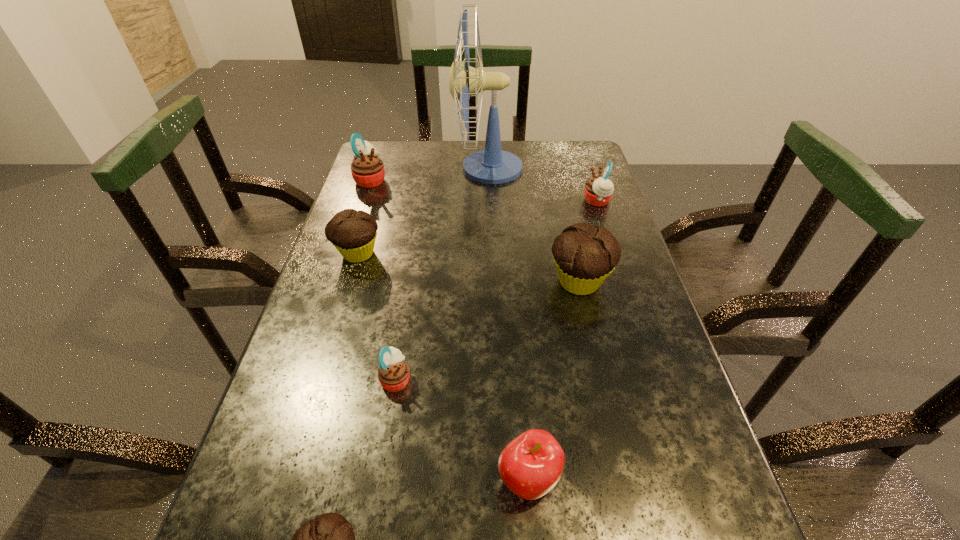
At what (x,y) coordinates should I click in order to perform the action: click on the closest muffin to the second nearest object. Please return your answer as a coordinate pair (x, y). Looking at the image, I should click on [393, 374].

Select which pink muffin is the second closest to the farthest pink muffin. Please provide its 2D coordinates. Your answer should be formatted as a tuple, i.e. [(x, y)], where the tuple contains the x and y coordinates of a point satisfying the conditions above.

[(393, 374)]

What are the coordinates of `the third closest pink muffin to the smallest chocolate muffin` in the screenshot? It's located at point(598,190).

Identify which chocolate muffin is the second closest to the tallest object. Please provide its 2D coordinates. Your answer should be formatted as a tuple, i.e. [(x, y)], where the tuple contains the x and y coordinates of a point satisfying the conditions above.

[(584, 256)]

Choose which chocolate muffin is the nearest neighbor to the second pink muffin from left to right. Please provide its 2D coordinates. Your answer should be formatted as a tuple, i.e. [(x, y)], where the tuple contains the x and y coordinates of a point satisfying the conditions above.

[(329, 539)]

Find the location of a particular element. free location that satisfies the following two spatial constraints: 1. on the front-facing side of the second nearest object; 2. on the left side of the smallest pink muffin is located at coordinates 380,479.

Locate an element on the screen. vacant space that satisfies the following two spatial constraints: 1. at the front of the fan where the blades are visible; 2. on the left side of the second nearest object is located at coordinates (495, 479).